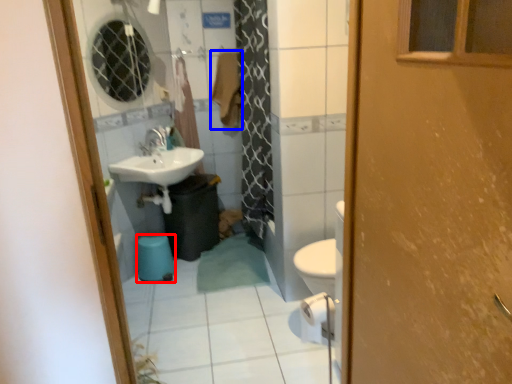
Question: Which point is closer to the camera, toilet bowl (highlighted by a red box) or laundry (highlighted by a blue box)?

Choices:
 (A) toilet bowl
 (B) laundry

Answer: (A)